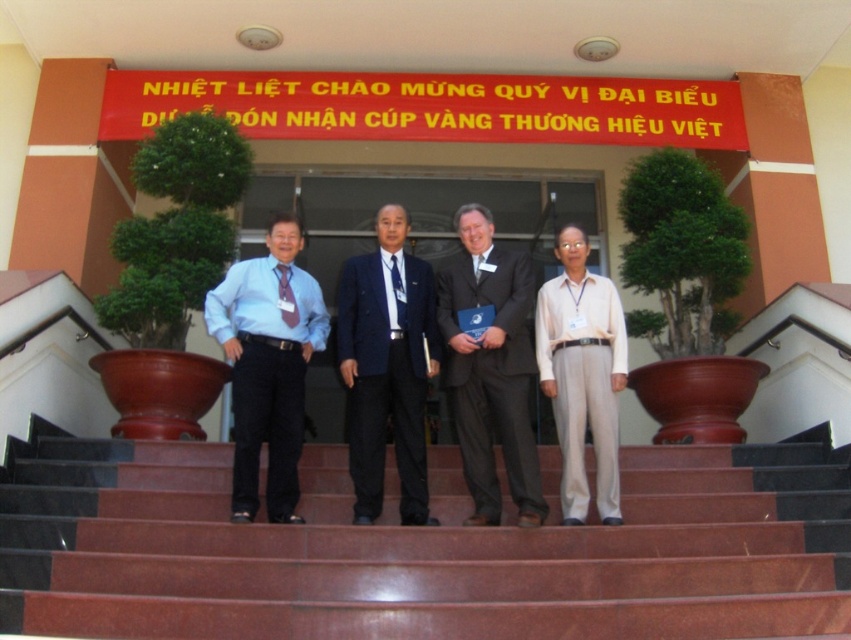
Question: Which object is positioned closest to the beige cotton pants at center?

Choices:
 (A) matte blue tie at left
 (B) matte blue shirt at center
 (C) marble stairs at center
 (D) navy blue wool suit at center

Answer: (D)

Question: Can you confirm if beige cotton pants at center is smaller than matte blue tie at left?

Choices:
 (A) yes
 (B) no

Answer: (B)

Question: Is navy blue wool suit at center in front of beige cotton pants at center?

Choices:
 (A) yes
 (B) no

Answer: (B)

Question: From the image, what is the correct spatial relationship of navy blue wool suit at center in relation to beige cotton pants at center?

Choices:
 (A) left
 (B) right

Answer: (A)

Question: Among these objects, which one is farthest from the camera?

Choices:
 (A) dark gray suit at center
 (B) matte blue shirt at center

Answer: (B)

Question: Which of the following is the closest to the observer?

Choices:
 (A) (295, 321)
 (B) (675, 480)

Answer: (B)